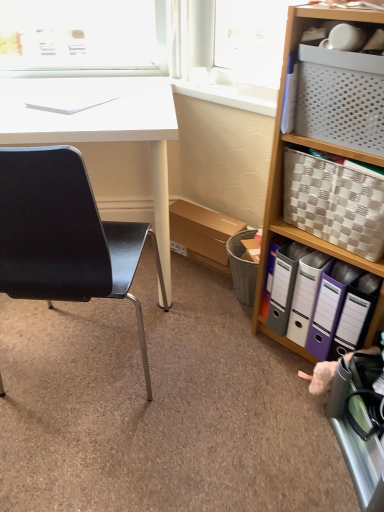
Question: From the image's perspective, is white glossy desk at left located above white plastic window sill at upper center?

Choices:
 (A) yes
 (B) no

Answer: (B)

Question: Would you consider white glossy desk at left to be distant from white plastic window sill at upper center?

Choices:
 (A) yes
 (B) no

Answer: (B)

Question: Is white glossy desk at left facing away from white plastic window sill at upper center?

Choices:
 (A) yes
 (B) no

Answer: (B)

Question: From a real-world perspective, is white glossy desk at left physically below white plastic window sill at upper center?

Choices:
 (A) no
 (B) yes

Answer: (B)

Question: Does white glossy desk at left have a lesser width compared to white plastic window sill at upper center?

Choices:
 (A) yes
 (B) no

Answer: (B)

Question: Does white glossy desk at left have a smaller size compared to white plastic window sill at upper center?

Choices:
 (A) no
 (B) yes

Answer: (A)

Question: From the image's perspective, would you say white woven basket at right is shown under white glossy desk at left?

Choices:
 (A) no
 (B) yes

Answer: (B)

Question: Is white woven basket at right at the left side of white glossy desk at left?

Choices:
 (A) yes
 (B) no

Answer: (B)

Question: Is white woven basket at right closer to camera compared to white glossy desk at left?

Choices:
 (A) yes
 (B) no

Answer: (A)

Question: Are white woven basket at right and white glossy desk at left beside each other?

Choices:
 (A) no
 (B) yes

Answer: (A)

Question: Is white woven basket at right at the right side of white glossy desk at left?

Choices:
 (A) no
 (B) yes

Answer: (B)

Question: From a real-world perspective, is white woven basket at right physically below white glossy desk at left?

Choices:
 (A) yes
 (B) no

Answer: (B)

Question: From the image's perspective, does black matte chair at left appear lower than white woven basket at right?

Choices:
 (A) yes
 (B) no

Answer: (A)